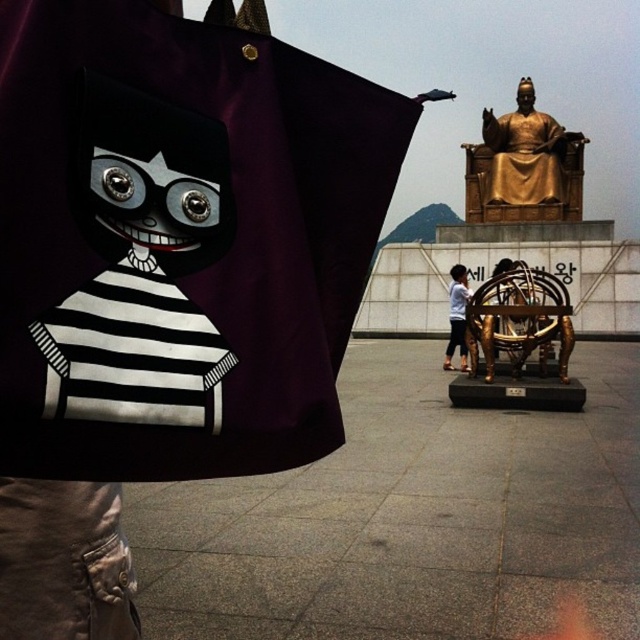
You are a photographer standing in the plaza and want to take a picture of both the gold metallic statue at upper right and the white cotton shirt at center. Since you have a wide angle lens, you can capture both in one shot. However, you need to ensure that the statue is positioned higher in the frame than the shirt. Is this possible?

Yes, because the gold metallic statue at upper right is located above the white cotton shirt at center, so positioning it higher in the frame is achievable.

You are a tourist in the plaza and want to take a photo of the gold metallic statue at upper right without the white cotton shirt at center blocking the view. Is this possible?

The gold metallic statue at upper right is further to the viewer than the white cotton shirt at center, so the statue is closer to you. Therefore, you can take a photo of the gold metallic statue at upper right without the white cotton shirt at center blocking the view since the shirt is behind the statue.